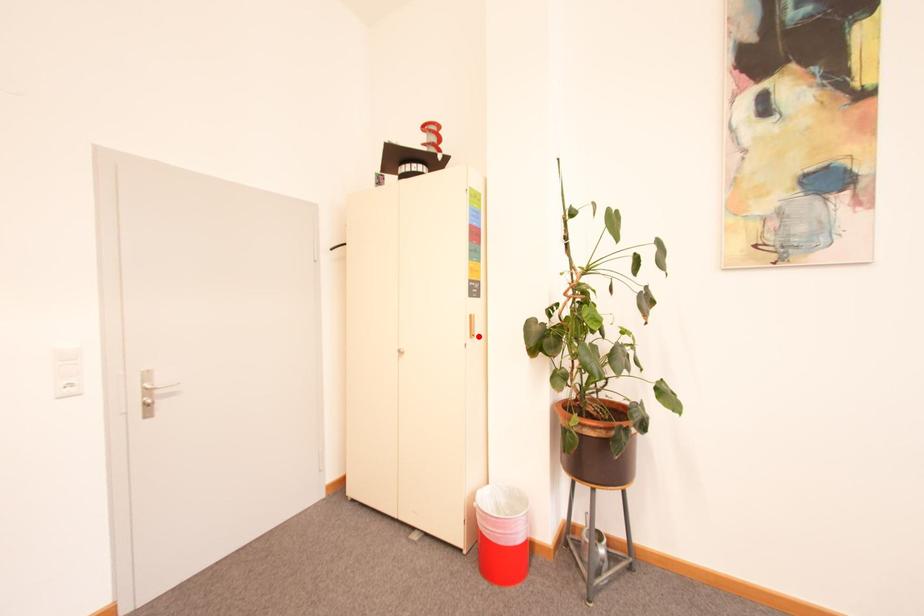
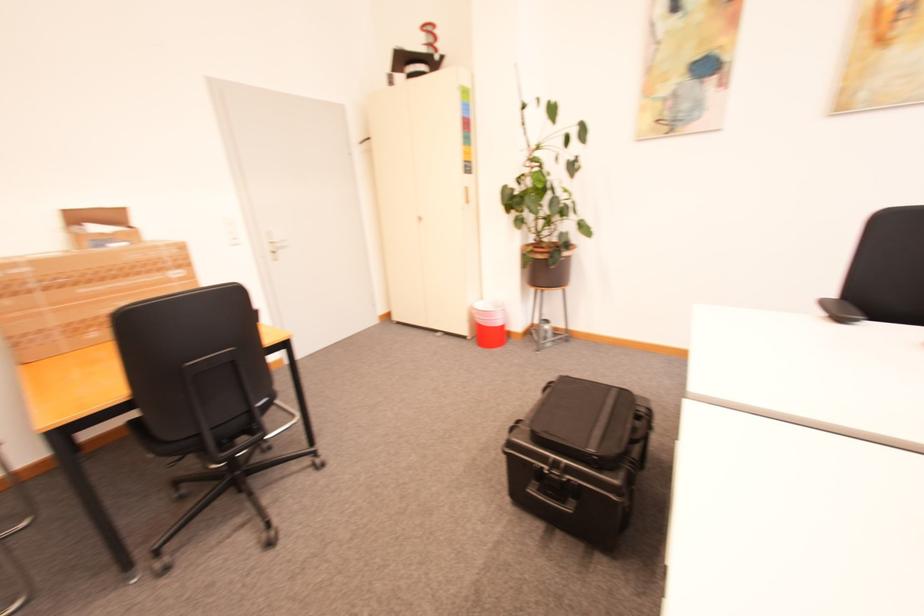
Where in the second image is the point corresponding to the highlighted location from the first image?

(473, 203)